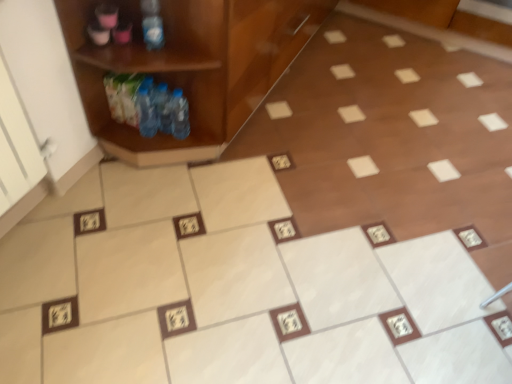
The height and width of the screenshot is (384, 512). In order to click on translucent plastic bottle at left, acting as the first bottle starting from the back in this screenshot , I will do `click(179, 115)`.

Identify the location of bottle that is on the right side of blue plastic bottle at upper left, the second bottle ordered from the bottom. This screenshot has width=512, height=384. (179, 115).

Does blue plastic bottle at upper left, the second bottle viewed from the back, appear on the right side of translucent plastic bottle at left, which ranks as the second bottle in top-to-bottom order?

Incorrect, blue plastic bottle at upper left, the second bottle viewed from the back, is not on the right side of translucent plastic bottle at left, which ranks as the second bottle in top-to-bottom order.

In the image, is blue plastic bottle at upper left, arranged as the first bottle when viewed from the front, positioned in front of or behind translucent plastic bottle at left, which ranks as the second bottle in top-to-bottom order?

Clearly, blue plastic bottle at upper left, arranged as the first bottle when viewed from the front, is in front of translucent plastic bottle at left, which ranks as the second bottle in top-to-bottom order.

From the picture: Is blue plastic bottle at upper left, the 1th bottle in the top-to-bottom sequence, facing towards translucent plastic bottle at left, which ranks as the second bottle in top-to-bottom order?

No, blue plastic bottle at upper left, the 1th bottle in the top-to-bottom sequence, does not turn towards translucent plastic bottle at left, which ranks as the second bottle in top-to-bottom order.

From the image's perspective, count 2nd bottles downward from the wooden cabinet at left and point to it. Please provide its 2D coordinates.

[(179, 115)]

Does point (213, 35) lie in front of point (175, 105)?

Yes, it is.

From a real-world perspective, relative to translucent plastic bottle at left, acting as the first bottle starting from the back, is wooden cabinet at left vertically above or below?

From a real-world perspective, wooden cabinet at left is physically above translucent plastic bottle at left, acting as the first bottle starting from the back.

Is wooden cabinet at left not close to translucent plastic bottle at left, which is the first bottle from bottom to top?

wooden cabinet at left is near translucent plastic bottle at left, which is the first bottle from bottom to top, not far away.

Which object is closer to the camera, translucent plastic bottle at left, acting as the first bottle starting from the back, or blue plastic bottle at upper left, arranged as the first bottle when viewed from the front?

Positioned in front is blue plastic bottle at upper left, arranged as the first bottle when viewed from the front.

Is translucent plastic bottle at left, which is the first bottle from bottom to top, taller than blue plastic bottle at upper left, the 1th bottle in the top-to-bottom sequence?

Incorrect, the height of translucent plastic bottle at left, which is the first bottle from bottom to top, is not larger of that of blue plastic bottle at upper left, the 1th bottle in the top-to-bottom sequence.

How distant is translucent plastic bottle at left, which ranks as the second bottle in top-to-bottom order, from blue plastic bottle at upper left, the 1th bottle in the top-to-bottom sequence?

The distance of translucent plastic bottle at left, which ranks as the second bottle in top-to-bottom order, from blue plastic bottle at upper left, the 1th bottle in the top-to-bottom sequence, is 10.59 inches.

Is translucent plastic bottle at left, acting as the first bottle starting from the back, turned away from blue plastic bottle at upper left, arranged as the first bottle when viewed from the front?

That's not correct — translucent plastic bottle at left, acting as the first bottle starting from the back, is not looking away from blue plastic bottle at upper left, arranged as the first bottle when viewed from the front.

How many degrees apart are the facing directions of blue plastic bottle at upper left, the second bottle ordered from the bottom, and wooden cabinet at left?

There is a 90.6-degree angle between the facing directions of blue plastic bottle at upper left, the second bottle ordered from the bottom, and wooden cabinet at left.

Who is taller, blue plastic bottle at upper left, the second bottle ordered from the bottom, or wooden cabinet at left?

wooden cabinet at left.

Could you tell me if blue plastic bottle at upper left, the second bottle viewed from the back, is facing wooden cabinet at left?

Yes, blue plastic bottle at upper left, the second bottle viewed from the back, is oriented towards wooden cabinet at left.

In terms of width, does blue plastic bottle at upper left, the second bottle viewed from the back, look wider or thinner when compared to wooden cabinet at left?

blue plastic bottle at upper left, the second bottle viewed from the back, is thinner than wooden cabinet at left.

From the image's perspective, does translucent plastic bottle at left, which is the first bottle from bottom to top, appear higher than wooden cabinet at left?

Incorrect, from the image's perspective, translucent plastic bottle at left, which is the first bottle from bottom to top, is lower than wooden cabinet at left.

Based on their positions, is translucent plastic bottle at left, acting as the first bottle starting from the back, located to the left or right of wooden cabinet at left?

In the image, translucent plastic bottle at left, acting as the first bottle starting from the back, appears on the left side of wooden cabinet at left.

Is translucent plastic bottle at left, which is the first bottle from bottom to top, next to wooden cabinet at left and touching it?

There is a gap between translucent plastic bottle at left, which is the first bottle from bottom to top, and wooden cabinet at left.

Consider the image. From a real-world perspective, is wooden cabinet at left above or below blue plastic bottle at upper left, the second bottle viewed from the back?

From a real-world perspective, wooden cabinet at left is physically below blue plastic bottle at upper left, the second bottle viewed from the back.

How different are the orientations of wooden cabinet at left and blue plastic bottle at upper left, the second bottle viewed from the back, in degrees?

The facing directions of wooden cabinet at left and blue plastic bottle at upper left, the second bottle viewed from the back, are 90.6 degrees apart.

Are wooden cabinet at left and blue plastic bottle at upper left, the 1th bottle in the top-to-bottom sequence, making contact?

wooden cabinet at left and blue plastic bottle at upper left, the 1th bottle in the top-to-bottom sequence, are not in contact.

Consider the image. In terms of size, does wooden cabinet at left appear bigger or smaller than blue plastic bottle at upper left, arranged as the first bottle when viewed from the front?

In the image, wooden cabinet at left appears to be larger than blue plastic bottle at upper left, arranged as the first bottle when viewed from the front.

The width and height of the screenshot is (512, 384). Identify the location of bottle behind the blue plastic bottle at upper left, arranged as the first bottle when viewed from the front. (179, 115).

This screenshot has height=384, width=512. I want to click on the 2nd bottle below the wooden cabinet at left (from the image's perspective), so click(x=179, y=115).

Which object lies nearer to the anchor point blue plastic bottle at upper left, the second bottle viewed from the back, translucent plastic bottle at left, acting as the first bottle starting from the back, or wooden cabinet at left?

wooden cabinet at left is positioned closer to the anchor blue plastic bottle at upper left, the second bottle viewed from the back.

From the image, which object appears to be nearer to wooden cabinet at left, blue plastic bottle at upper left, the second bottle viewed from the back, or translucent plastic bottle at left, acting as the first bottle starting from the back?

translucent plastic bottle at left, acting as the first bottle starting from the back, lies closer to wooden cabinet at left than the other object.

Based on the photo, looking at the image, which one is located closer to blue plastic bottle at upper left, the second bottle ordered from the bottom, wooden cabinet at left or translucent plastic bottle at left, acting as the first bottle starting from the back?

Based on the image, wooden cabinet at left appears to be nearer to blue plastic bottle at upper left, the second bottle ordered from the bottom.

When comparing their distances from wooden cabinet at left, does translucent plastic bottle at left, which is counted as the 2th bottle, starting from the front, or blue plastic bottle at upper left, the 1th bottle in the top-to-bottom sequence, seem closer?

translucent plastic bottle at left, which is counted as the 2th bottle, starting from the front, lies closer to wooden cabinet at left than the other object.

From the image, which object appears to be farther from translucent plastic bottle at left, which ranks as the second bottle in top-to-bottom order, wooden cabinet at left or blue plastic bottle at upper left, the 1th bottle in the top-to-bottom sequence?

blue plastic bottle at upper left, the 1th bottle in the top-to-bottom sequence, is positioned further to the anchor translucent plastic bottle at left, which ranks as the second bottle in top-to-bottom order.

From the image, which object appears to be nearer to translucent plastic bottle at left, which ranks as the second bottle in top-to-bottom order, blue plastic bottle at upper left, the 1th bottle in the top-to-bottom sequence, or wooden cabinet at left?

wooden cabinet at left lies closer to translucent plastic bottle at left, which ranks as the second bottle in top-to-bottom order, than the other object.

The height and width of the screenshot is (384, 512). I want to click on bottle between wooden cabinet at left and translucent plastic bottle at left, acting as the first bottle starting from the back, from top to bottom, so click(152, 24).